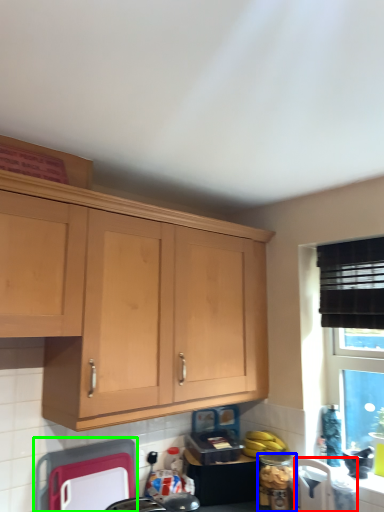
Question: Estimate the real-world distances between objects in this image. Which object is closer to appliance (highlighted by a red box), appliance (highlighted by a blue box) or appliance (highlighted by a green box)?

Choices:
 (A) appliance
 (B) appliance

Answer: (A)